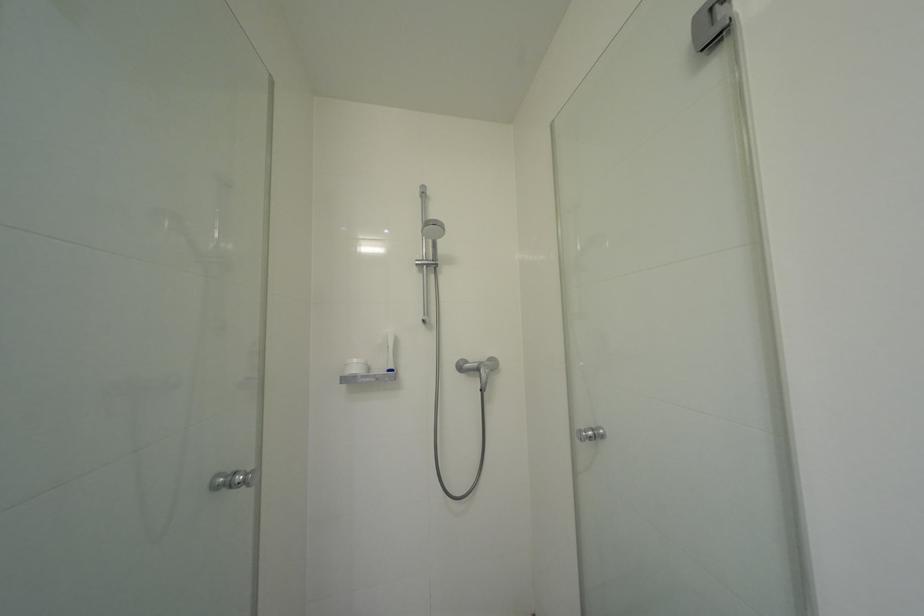
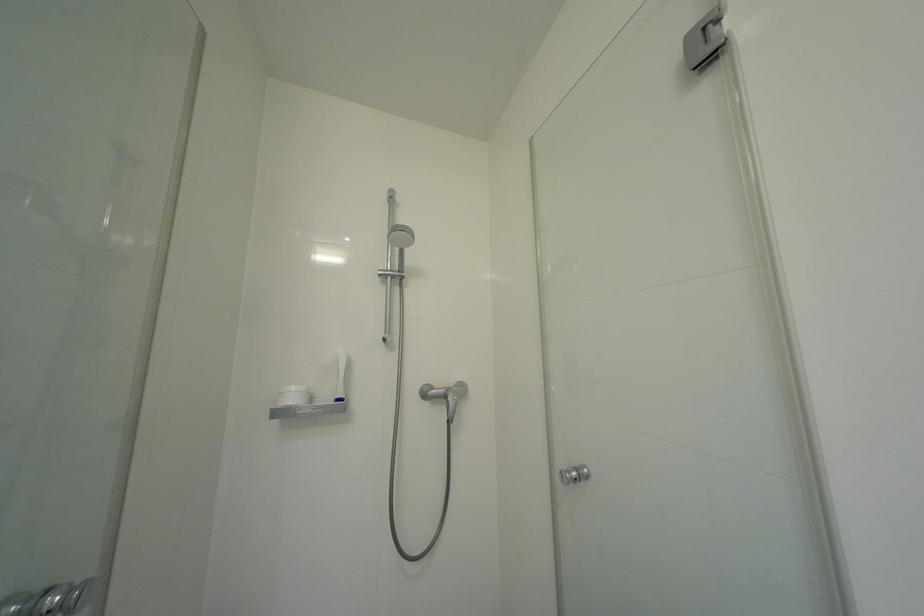
Question: Based on the continuous images, in which direction is the camera rotating? Reply with the corresponding letter.

Choices:
 (A) Left
 (B) Right
 (C) Up
 (D) Down

Answer: (B)